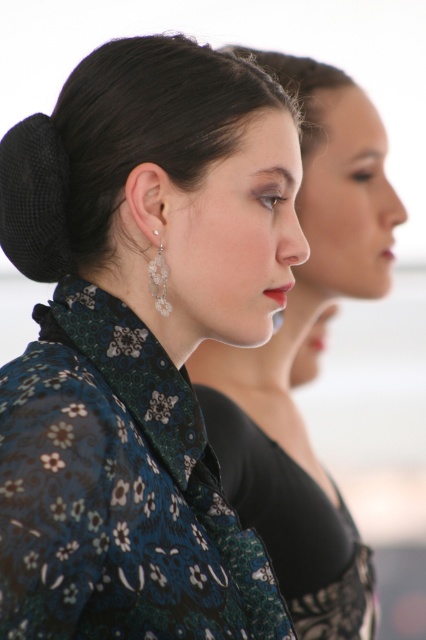
Is black netted bun at upper center further to the viewer compared to floral-patterned fabric dress at center?

That is False.

Is point (71, 84) behind point (215, 404)?

No.

Which is in front, point (86, 259) or point (313, 621)?

Positioned in front is point (86, 259).

Find the location of a particular element. black netted bun at upper center is located at coordinates (118, 141).

Who is positioned more to the left, matte floral-patterned blouse at center or floral-patterned fabric dress at center?

From the viewer's perspective, matte floral-patterned blouse at center appears more on the left side.

Between point (285, 570) and point (371, 608), which one is positioned behind?

The point (371, 608) is more distant.

I want to click on matte floral-patterned blouse at center, so [x=298, y=348].

Identify the location of floral-patterned fabric at center. The height and width of the screenshot is (640, 426). (140, 340).

Does floral-patterned fabric at center have a greater height compared to black netted bun at upper center?

Yes, floral-patterned fabric at center is taller than black netted bun at upper center.

Image resolution: width=426 pixels, height=640 pixels. What do you see at coordinates (140, 340) in the screenshot?
I see `floral-patterned fabric at center` at bounding box center [140, 340].

Locate an element on the screen. The width and height of the screenshot is (426, 640). floral-patterned fabric at center is located at coordinates (140, 340).